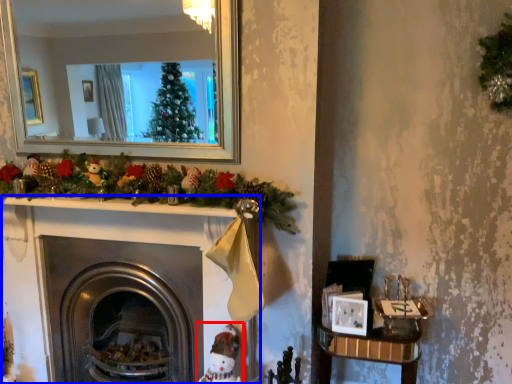
Question: Which object appears farthest to the camera in this image, toy (highlighted by a red box) or fireplace (highlighted by a blue box)?

Choices:
 (A) toy
 (B) fireplace

Answer: (B)